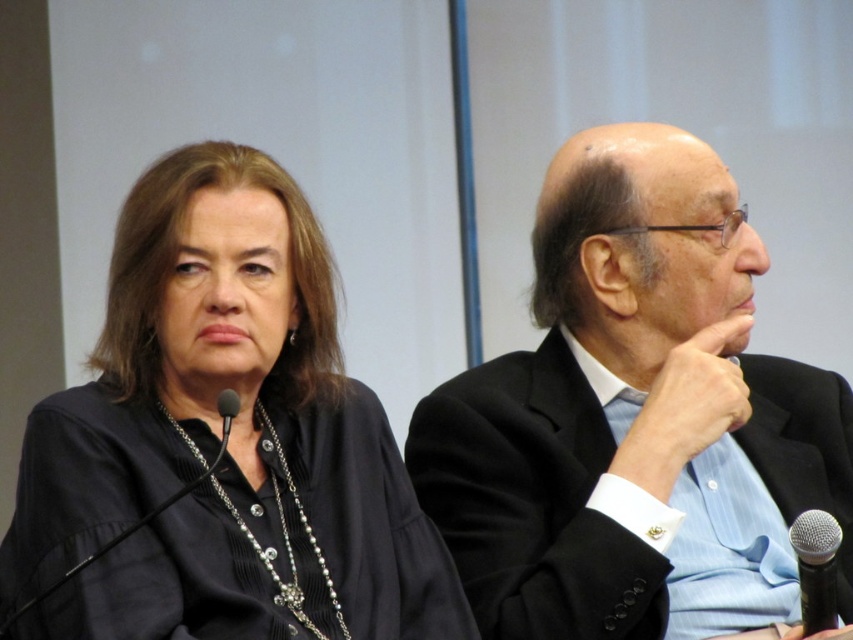
You are standing in front of the two people in the image. Which of the two points, point (698, 508) or point (228, 605), is closer to you?

Point (228, 605) is closer to you because it is in front of point (698, 508).